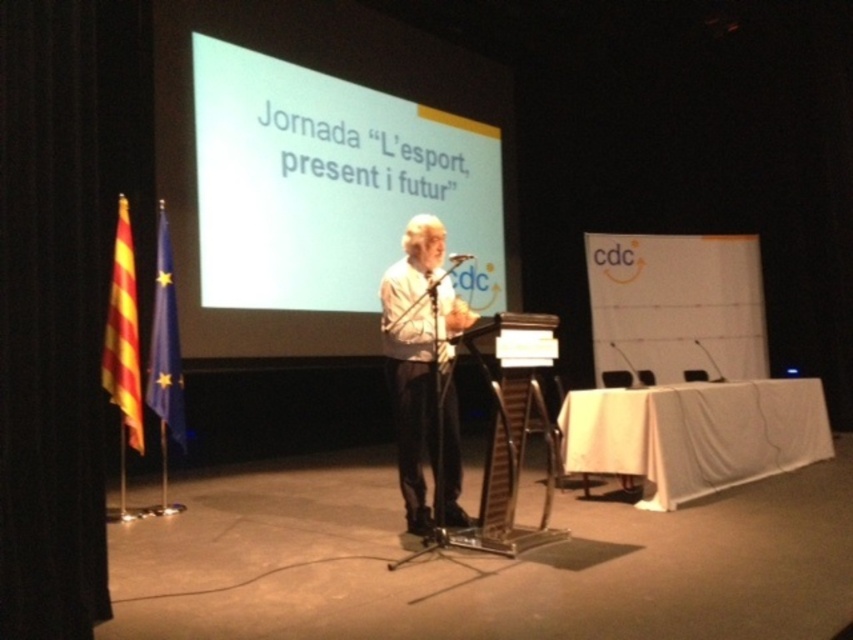
You are attending a conference and need to adjust your seating to have a better view of the speaker. The speaker is wearing a white matte shirt at center and holding a metallic silver microphone at center. Which object should you focus on to ensure you can see both the speaker and their presentation clearly?

A: The white matte shirt at center is taller than the metallic silver microphone at center, so focusing on the white matte shirt at center will allow you to see both the speaker and their presentation clearly.